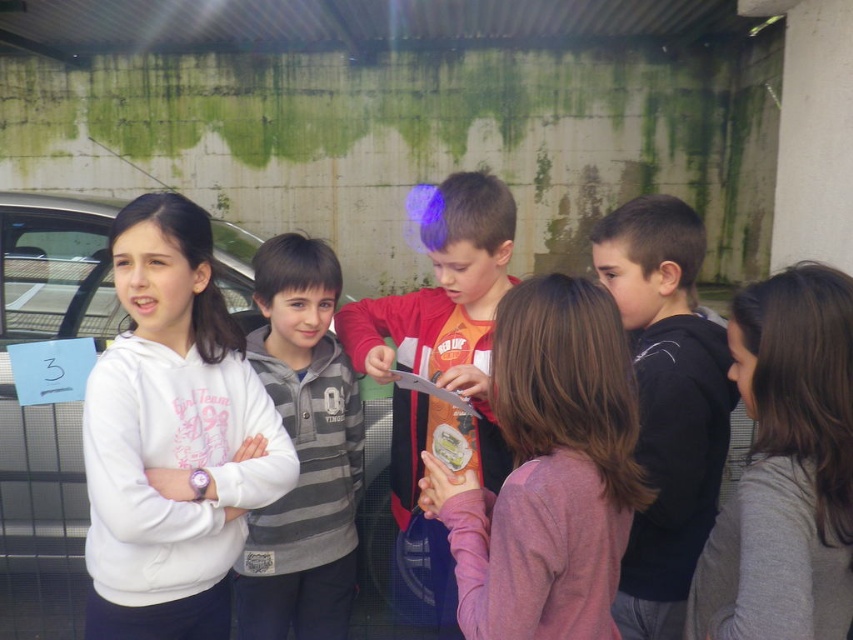
Question: Does black matte hoodie at center have a larger size compared to red shirt at center?

Choices:
 (A) yes
 (B) no

Answer: (B)

Question: Which of the following is the closest to the observer?

Choices:
 (A) gray matte sweater at center
 (B) gray striped hoodie at center
 (C) white fleece sweatshirt at left
 (D) red shirt at center

Answer: (A)

Question: Which point is farther from the camera taking this photo?

Choices:
 (A) (276, 289)
 (B) (606, 536)

Answer: (A)

Question: Which point is closer to the camera?

Choices:
 (A) (320, 564)
 (B) (675, 490)
 (C) (465, 550)

Answer: (C)

Question: Is white fleece sweatshirt at left bigger than orange cotton shirt at center?

Choices:
 (A) yes
 (B) no

Answer: (A)

Question: Is orange cotton shirt at center behind red shirt at center?

Choices:
 (A) no
 (B) yes

Answer: (A)